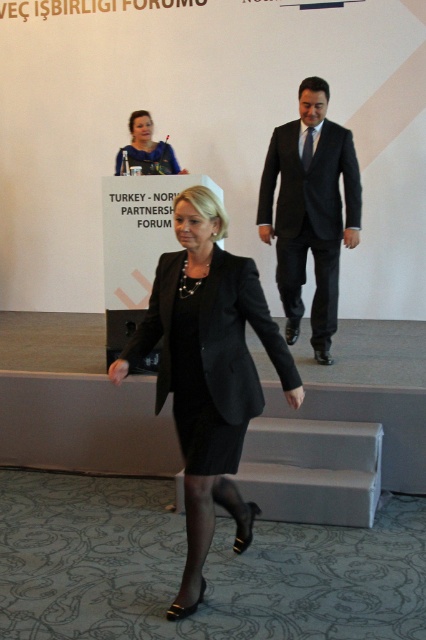
You are an event organizer who needs to ensure proper seating arrangements. You observe the black matte blazer at center and the matte black dress at center. Which of these items requires more space when seated?

The black matte blazer at center requires more space when seated because it has a larger size compared to the matte black dress at center.

You are a photographer at the Turkey Norway Partnership Forum. You see the black matte blazer at center and the black suit at center. Which one is closer to the camera?

The black matte blazer at center is below the black suit at center, so the black suit at center is closer to the camera.